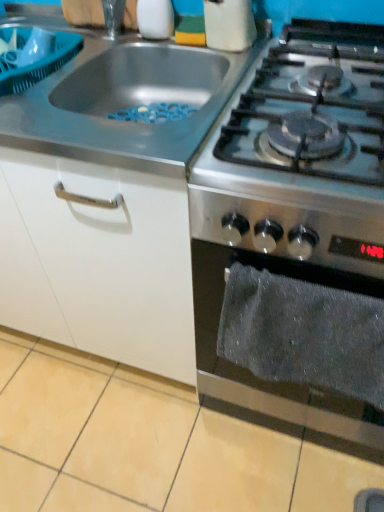
In order to click on free space on the front side of white glossy salt shaker at upper center in this screenshot , I will do pyautogui.click(x=177, y=53).